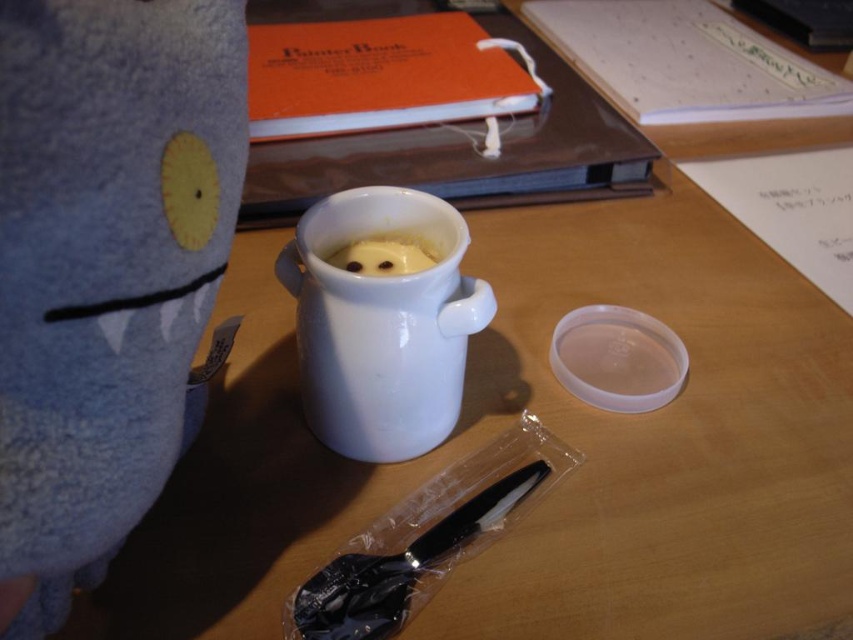
Question: From the image, what is the correct spatial relationship of white glossy mug at center in relation to white matte coffee cup at center?

Choices:
 (A) below
 (B) above

Answer: (A)

Question: Among these points, which one is farthest from the camera?

Choices:
 (A) (315, 237)
 (B) (375, 257)

Answer: (B)

Question: Is white glossy mug at center behind white matte coffee cup at center?

Choices:
 (A) yes
 (B) no

Answer: (B)

Question: Does white glossy mug at center appear under white matte coffee cup at center?

Choices:
 (A) no
 (B) yes

Answer: (B)